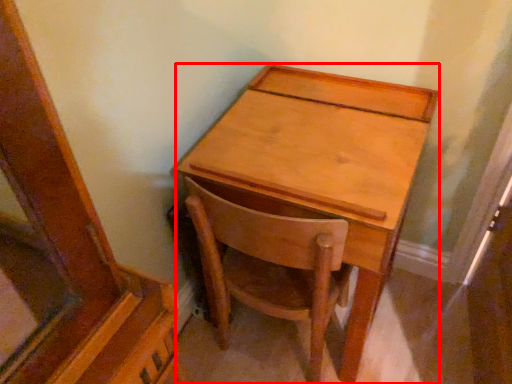
Question: In this image, where is desk (annotated by the red box) located relative to chair?

Choices:
 (A) right
 (B) left

Answer: (A)